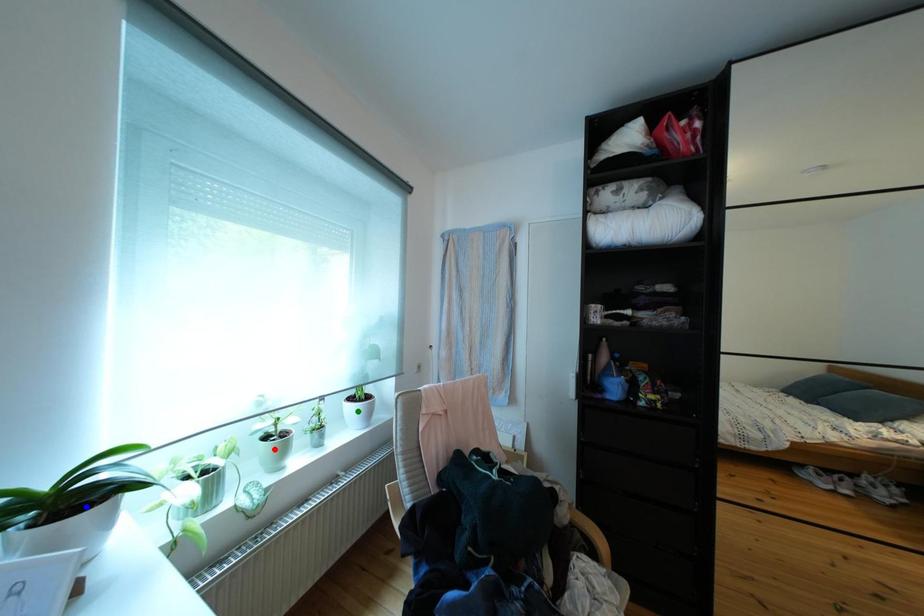
Looking at this image, order these from farthest to nearest:
A) red point
B) blue point
C) green point

green point < red point < blue point